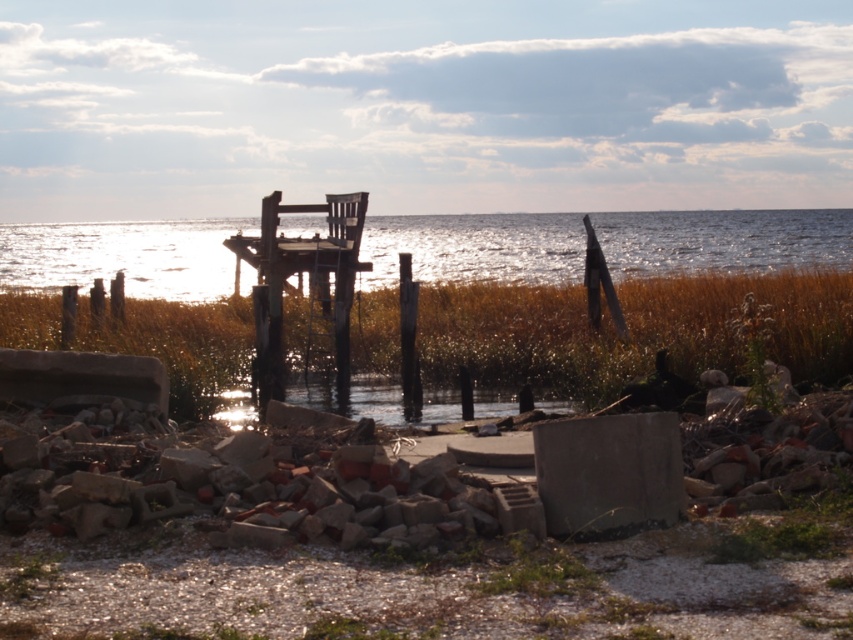
Question: Does glistening water at center appear on the right side of wooden dock at center?

Choices:
 (A) yes
 (B) no

Answer: (A)

Question: From the image, what is the correct spatial relationship of glistening water at center in relation to wooden dock at center?

Choices:
 (A) right
 (B) left

Answer: (A)

Question: Which of the following is the closest to the observer?

Choices:
 (A) glistening water at center
 (B) wooden dock at center

Answer: (B)

Question: Which point is closer to the camera taking this photo?

Choices:
 (A) (273, 248)
 (B) (103, 230)

Answer: (A)

Question: Which object appears farthest from the camera in this image?

Choices:
 (A) wooden dock at center
 (B) glistening water at center

Answer: (B)

Question: Can you confirm if glistening water at center is thinner than wooden dock at center?

Choices:
 (A) yes
 (B) no

Answer: (B)